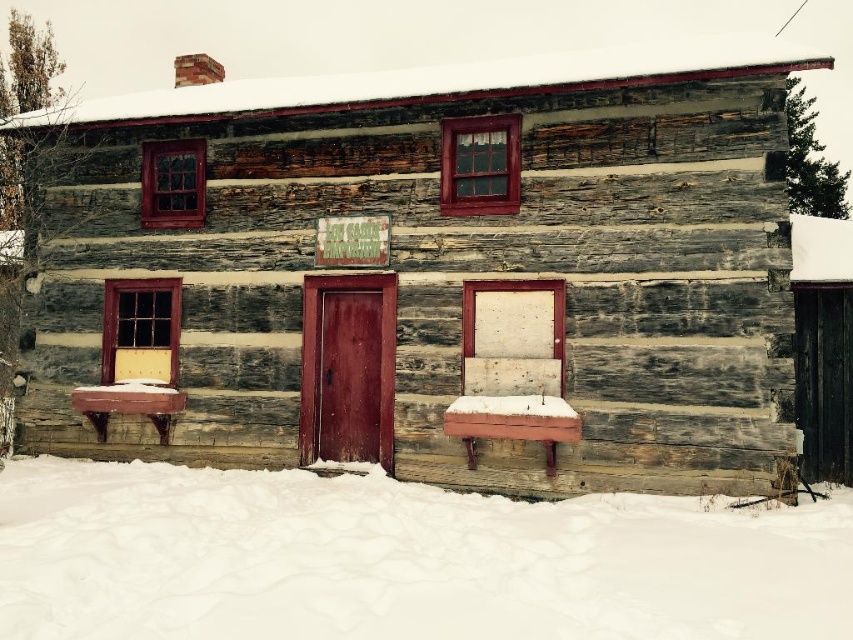
You are standing in front of the wooden bench at center and want to enter the wooden cabin at center. Which direction should you move to reach the cabin?

The wooden cabin at center is above the wooden bench at center, so you should move upward to reach it.

Looking at this image, you are standing in front of the rustic log cabin and want to take a photo of the point at coordinate point (614, 70). If your camera has a maximum focus range of 10 meters, will it be able to focus on that point?

The point at coordinate point (614, 70) is 9.59 meters from the camera, so yes, the camera can focus on it since it is within the 10 meters range.

You are standing in front of the wooden bench at center and want to enter the wooden cabin at center. In which direction should you walk to reach the cabin?

You should walk to the right to reach the wooden cabin at center because the cabin is located to the left of the bench, so moving right from the bench will face you towards the cabin.